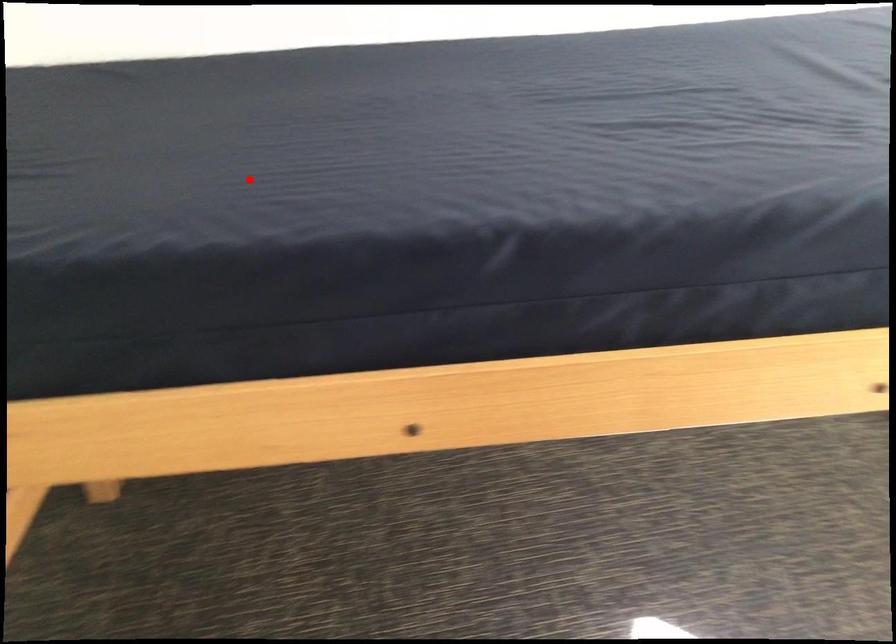
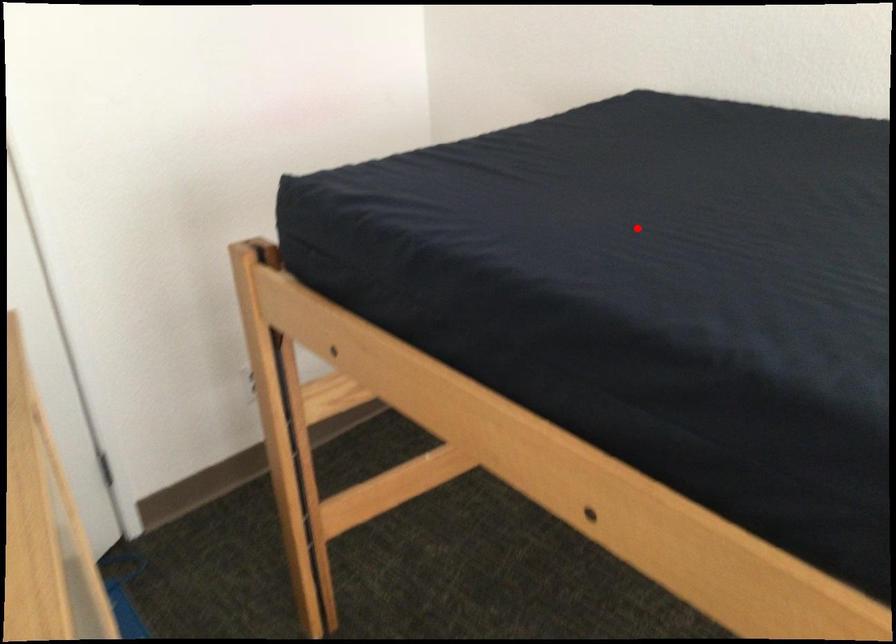
I am providing you with two images of the same scene from different viewpoints. A red point is marked on the first image and another point is marked on the second image. Does the point marked in image1 correspond to the same location as the one in image2?

Yes